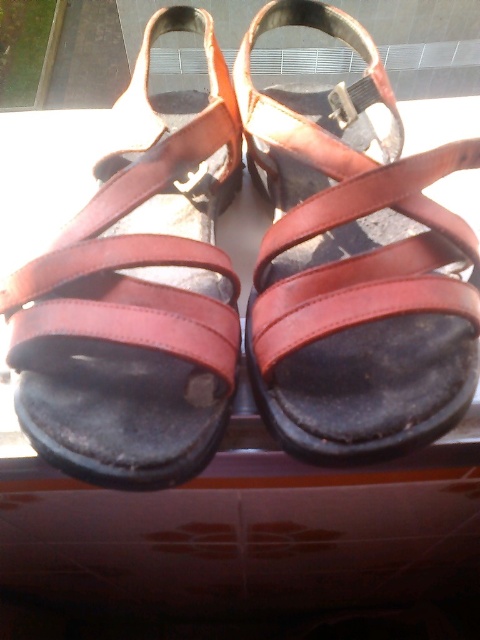
You are a delivery robot positioned at the origin point of the coordinate system. You need to pick up the brown leather sandal at center. What are the coordinates where you should move to retrieve it?

The brown leather sandal at center is located at coordinates point (352, 264) so you should move to that position to retrieve it.

You are a delivery person trying to load a package into a small space on the vehicle. You see the brown leather sandal at center and the brown leather sandals at center. Which one is more to the left?

The brown leather sandal at center is more to the left because it is positioned on the left side of the brown leather sandals at center.